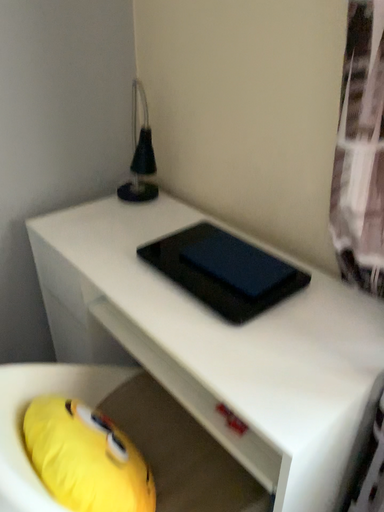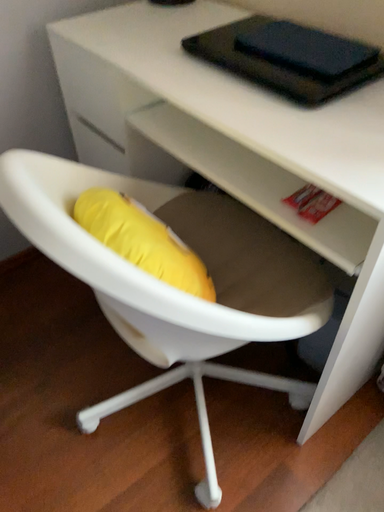
Question: How did the camera likely rotate when shooting the video?

Choices:
 (A) rotated downward
 (B) rotated upward

Answer: (A)